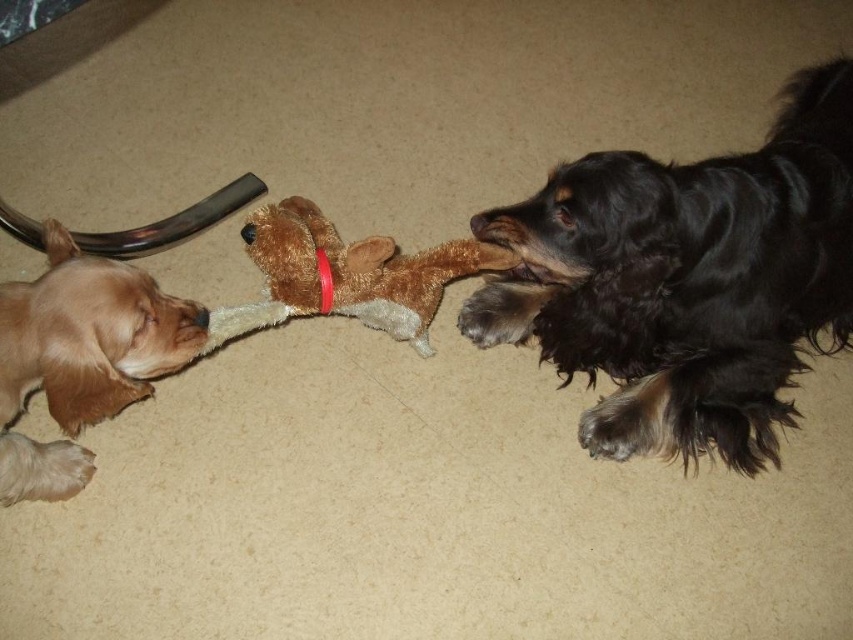
Question: Based on their relative distances, which object is farther from the brown plush toy at center?

Choices:
 (A) black silky dog at right
 (B) light brown fur at left

Answer: (B)

Question: From the image, what is the correct spatial relationship of light brown fur at left in relation to brown plush toy at center?

Choices:
 (A) below
 (B) above

Answer: (A)

Question: Is black silky dog at right wider than light brown fur at left?

Choices:
 (A) no
 (B) yes

Answer: (B)

Question: Which of these objects is positioned closest to the light brown fur at left?

Choices:
 (A) brown plush toy at center
 (B) black silky dog at right

Answer: (A)

Question: Which object is the closest to the black silky dog at right?

Choices:
 (A) brown plush toy at center
 (B) light brown fur at left

Answer: (A)

Question: Is black silky dog at right above brown plush toy at center?

Choices:
 (A) yes
 (B) no

Answer: (A)